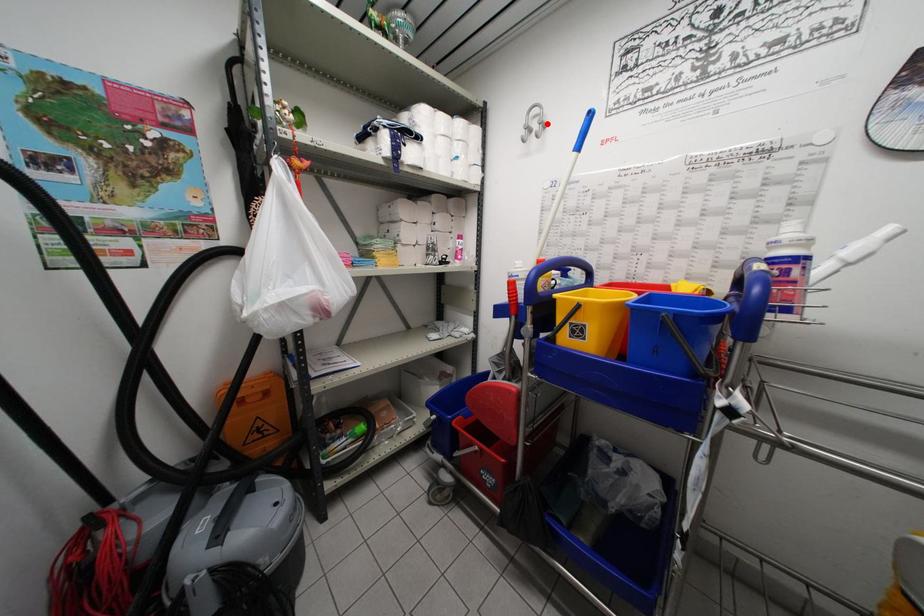
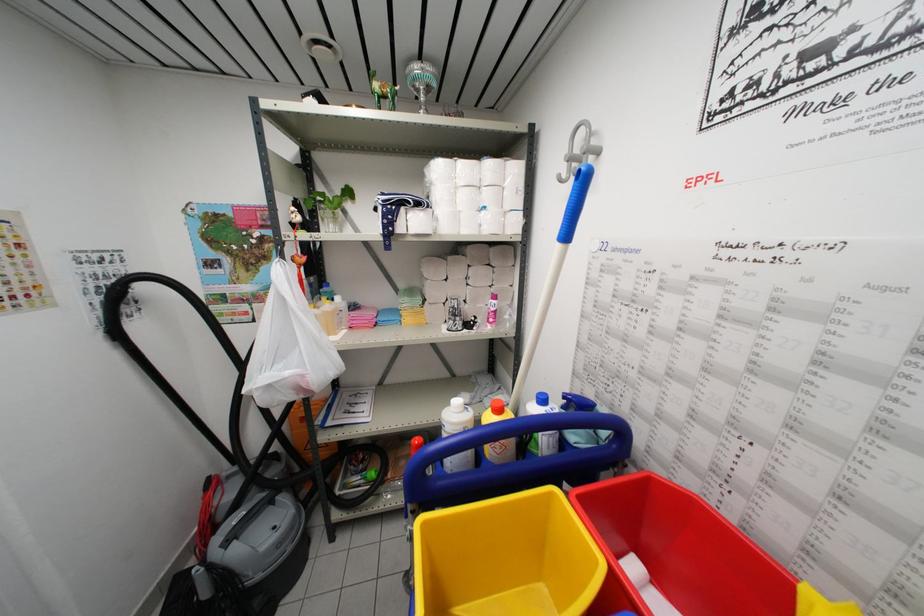
The point at the highlighted location is marked in the first image. Where is the corresponding point in the second image?

(597, 148)